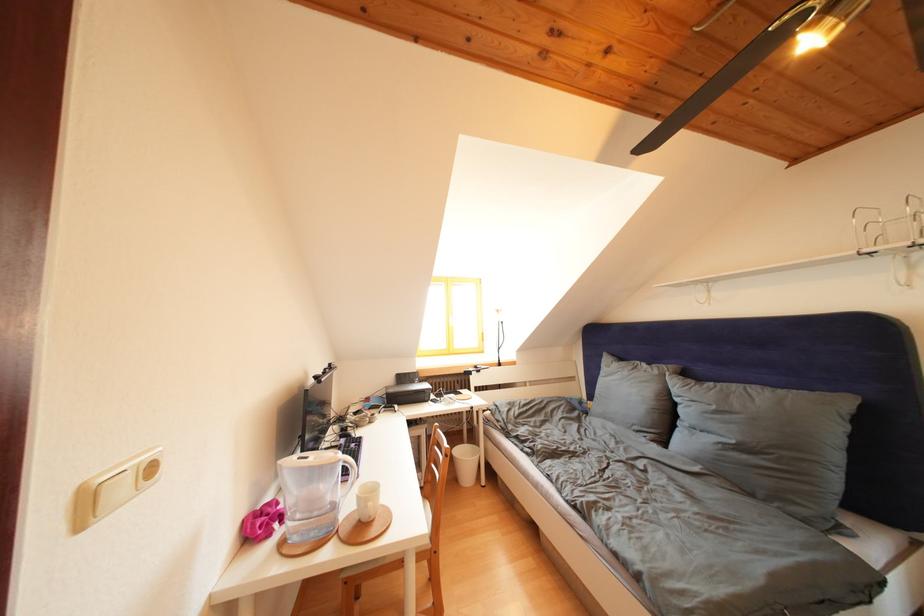
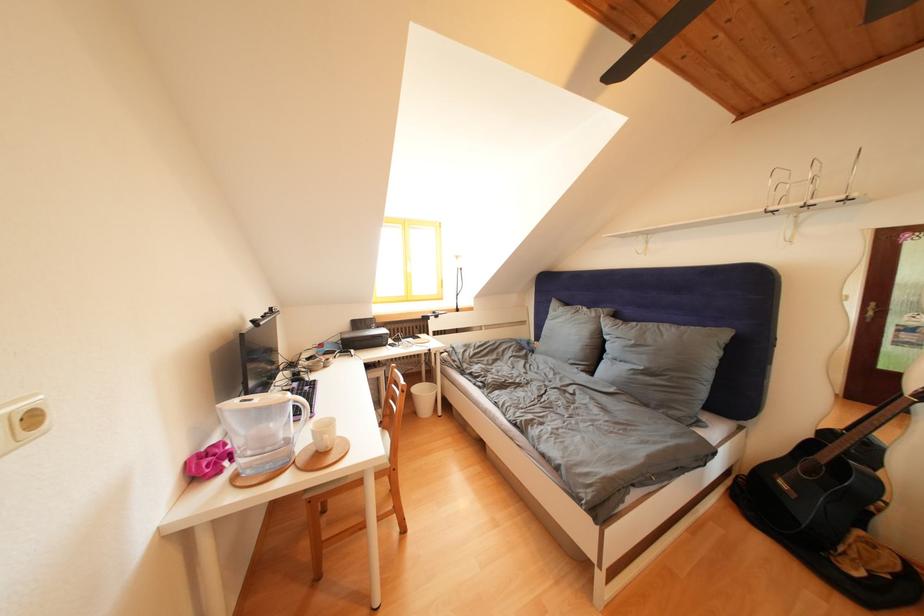
The point at (663, 377) is marked in the first image. Where is the corresponding point in the second image?

(602, 320)